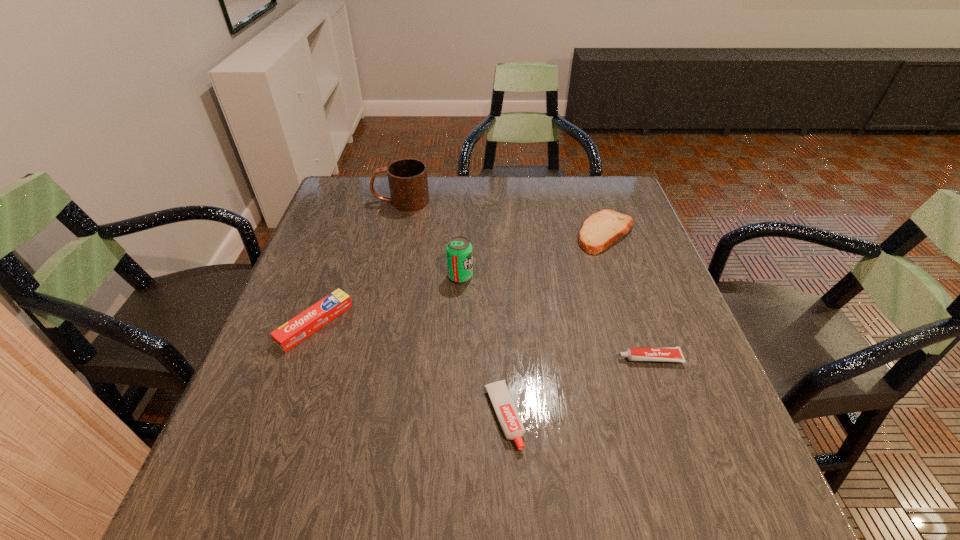
Identify the location of free space at the near right corner of the desktop. The width and height of the screenshot is (960, 540). (661, 470).

The width and height of the screenshot is (960, 540). I want to click on unoccupied area between the third object from right to left and the second farthest object, so click(555, 325).

Identify the location of blank region between the pita bread and the fourth object from left to right. (555, 325).

Where is `unoccupied position between the rightmost toothpaste and the second toothpaste from right to left`? The width and height of the screenshot is (960, 540). unoccupied position between the rightmost toothpaste and the second toothpaste from right to left is located at coordinates (577, 387).

Locate an element on the screen. free space between the pita bread and the nearest toothpaste is located at coordinates (555, 325).

I want to click on empty location between the pita bread and the second toothpaste from right to left, so click(x=555, y=325).

The height and width of the screenshot is (540, 960). In order to click on free space between the third object from right to left and the second farthest object in this screenshot , I will do `click(555, 325)`.

This screenshot has height=540, width=960. I want to click on empty space that is in between the fourth nearest object and the pita bread, so click(533, 255).

Where is `empty space between the farthest object and the leftmost toothpaste`? empty space between the farthest object and the leftmost toothpaste is located at coordinates (358, 262).

Locate an element on the screen. The width and height of the screenshot is (960, 540). free space that is in between the nearest object and the fifth nearest object is located at coordinates (555, 325).